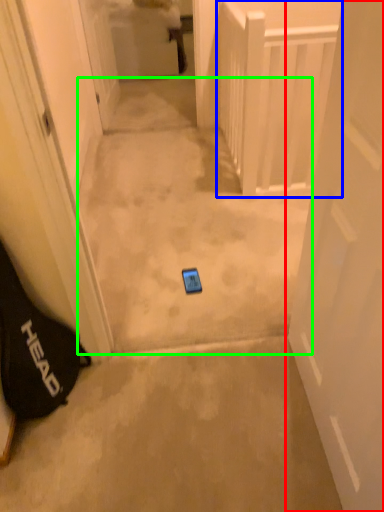
Question: Considering the real-world distances, which object is farthest from door (highlighted by a red box)? balustrade (highlighted by a blue box) or path (highlighted by a green box)?

Choices:
 (A) balustrade
 (B) path

Answer: (A)